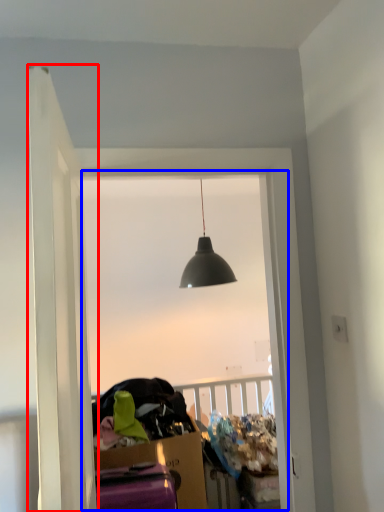
Question: Which object is further to the camera taking this photo, door (highlighted by a red box) or window (highlighted by a blue box)?

Choices:
 (A) door
 (B) window

Answer: (B)